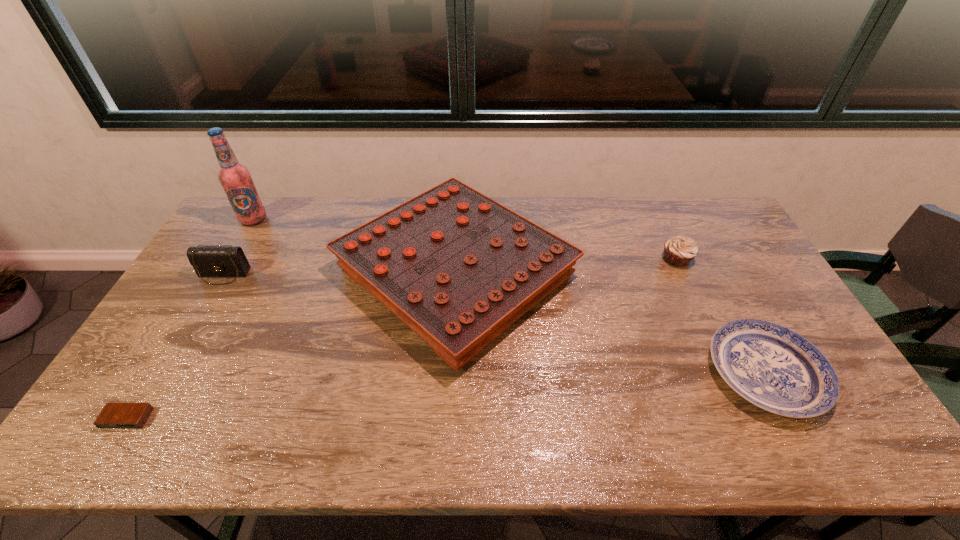
You are a GUI agent. You are given a task and a screenshot of the screen. Output one action in this format:
    pyautogui.click(x=<x>, y=<y>)
    Task: Click on the free space that is in between the shortest object and the fourth tallest object
    Image resolution: width=960 pixels, height=540 pixels.
    Given the screenshot: What is the action you would take?
    pyautogui.click(x=402, y=339)

Where is `unoccupied area between the clutch bag and the fourth object from left to right`? This screenshot has height=540, width=960. unoccupied area between the clutch bag and the fourth object from left to right is located at coordinates (340, 274).

Image resolution: width=960 pixels, height=540 pixels. I want to click on free space between the tallest object and the clutch bag, so click(238, 247).

At what (x,y) coordinates should I click in order to perform the action: click on empty location between the third object from right to left and the plate. Please return your answer as a coordinate pair (x, y). This screenshot has width=960, height=540. Looking at the image, I should click on (611, 323).

Select which object is the third closest to the plate. Please provide its 2D coordinates. Your answer should be formatted as a tuple, i.e. [(x, y)], where the tuple contains the x and y coordinates of a point satisfying the conditions above.

[(211, 261)]

Locate an element on the screen. The image size is (960, 540). object that stands as the closest to the tallest object is located at coordinates (211, 261).

At what (x,y) coordinates should I click in order to perform the action: click on free point that satisfies the following two spatial constraints: 1. on the front flap of the clutch bag; 2. on the right side of the fifth tallest object. Please return your answer as a coordinate pair (x, y). Looking at the image, I should click on (166, 373).